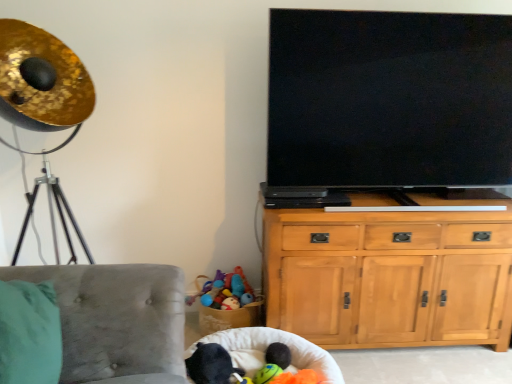
This screenshot has height=384, width=512. Find the location of `white fabric bean bag at lower center`. white fabric bean bag at lower center is located at coordinates (276, 341).

This screenshot has height=384, width=512. Describe the element at coordinates (276, 341) in the screenshot. I see `white fabric bean bag at lower center` at that location.

This screenshot has width=512, height=384. What do you see at coordinates (116, 320) in the screenshot? I see `velvet grey chair at lower left` at bounding box center [116, 320].

At what (x,y) coordinates should I click in order to perform the action: click on white fabric bean bag at lower center. Please return your answer as a coordinate pair (x, y). The width and height of the screenshot is (512, 384). Looking at the image, I should click on (276, 341).

Would you consider velvet grey chair at lower left to be distant from black plush toy at lower center?

That's not correct — velvet grey chair at lower left is a little close to black plush toy at lower center.

Which object is thinner, velvet grey chair at lower left or black plush toy at lower center?

black plush toy at lower center.

From a real-world perspective, is velvet grey chair at lower left below black plush toy at lower center?

No, from a real-world perspective, velvet grey chair at lower left is not under black plush toy at lower center.

How much distance is there between velvet grey chair at lower left and black plush toy at lower center?

They are 19.33 inches apart.

Who is smaller, light wood cabinet at center right or velvet grey chair at lower left?

With smaller size is light wood cabinet at center right.

Is light wood cabinet at center right far from velvet grey chair at lower left?

No, there isn't a large distance between light wood cabinet at center right and velvet grey chair at lower left.

Which is behind, point (405, 315) or point (123, 328)?

The point (405, 315) is behind.

How distant is light wood cabinet at center right from velvet grey chair at lower left?

They are 39.29 inches apart.

Are black plush toy at lower center and velvet grey chair at lower left beside each other?

There is a gap between black plush toy at lower center and velvet grey chair at lower left.

Considering the relative sizes of black plush toy at lower center and velvet grey chair at lower left in the image provided, is black plush toy at lower center bigger than velvet grey chair at lower left?

Actually, black plush toy at lower center might be smaller than velvet grey chair at lower left.

Based on their positions, is black plush toy at lower center located to the left or right of velvet grey chair at lower left?

Clearly, black plush toy at lower center is on the right of velvet grey chair at lower left in the image.

From the image's perspective, is black plush toy at lower center above or below velvet grey chair at lower left?

Clearly, from the image's perspective, black plush toy at lower center is below velvet grey chair at lower left.

From the image's perspective, is black plush toy at lower center below flat screen tv at upper right?

Yes.

Who is shorter, black plush toy at lower center or flat screen tv at upper right?

With less height is black plush toy at lower center.

From a real-world perspective, between black plush toy at lower center and flat screen tv at upper right, who is vertically lower?

From a 3D spatial view, black plush toy at lower center is below.

Considering the sizes of objects black plush toy at lower center and flat screen tv at upper right in the image provided, who is smaller, black plush toy at lower center or flat screen tv at upper right?

Smaller between the two is black plush toy at lower center.

Based on the photo, from a real-world perspective, who is located lower, soft plush toy at lower center or velvet grey chair at lower left?

soft plush toy at lower center is physically lower.

Is soft plush toy at lower center spatially inside velvet grey chair at lower left, or outside of it?

soft plush toy at lower center is outside velvet grey chair at lower left.

From the image's perspective, does soft plush toy at lower center appear lower than velvet grey chair at lower left?

Indeed, from the image's perspective, soft plush toy at lower center is shown beneath velvet grey chair at lower left.

Is soft plush toy at lower center aimed at velvet grey chair at lower left?

No, soft plush toy at lower center is not facing towards velvet grey chair at lower left.

Would you consider white fabric bean bag at lower center to be distant from light wood cabinet at center right?

They are positioned close to each other.

From a real-world perspective, which is physically above, white fabric bean bag at lower center or light wood cabinet at center right?

light wood cabinet at center right is physically above.

Is white fabric bean bag at lower center inside the boundaries of light wood cabinet at center right, or outside?

white fabric bean bag at lower center cannot be found inside light wood cabinet at center right.

In terms of height, does white fabric bean bag at lower center look taller or shorter compared to light wood cabinet at center right?

Considering their sizes, white fabric bean bag at lower center has less height than light wood cabinet at center right.

Is flat screen tv at upper right far away from black plush toy at lower center?

Indeed, flat screen tv at upper right is not near black plush toy at lower center.

Consider the image. Considering the positions of objects flat screen tv at upper right and black plush toy at lower center in the image provided, who is in front, flat screen tv at upper right or black plush toy at lower center?

black plush toy at lower center is closer to the camera.

Looking at the image, does flat screen tv at upper right seem bigger or smaller compared to black plush toy at lower center?

In the image, flat screen tv at upper right appears to be larger than black plush toy at lower center.

From a real-world perspective, which is physically below, flat screen tv at upper right or black plush toy at lower center?

In real-world perspective, black plush toy at lower center is lower.

At what (x,y) coordinates should I click in order to perform the action: click on chair in front of the black plush toy at lower center. Please return your answer as a coordinate pair (x, y). Looking at the image, I should click on (116, 320).

Where is `chair lying on the left of light wood cabinet at center right`? chair lying on the left of light wood cabinet at center right is located at coordinates (116, 320).

Looking at the image, which one is located closer to soft plush toy at lower center, light wood cabinet at center right or black plush toy at lower center?

The object closer to soft plush toy at lower center is black plush toy at lower center.

When comparing their distances from light wood cabinet at center right, does white fabric bean bag at lower center or flat screen tv at upper right seem closer?

white fabric bean bag at lower center lies closer to light wood cabinet at center right than the other object.

When comparing their distances from velvet grey chair at lower left, does soft plush toy at lower center or flat screen tv at upper right seem further?

flat screen tv at upper right is further to velvet grey chair at lower left.

Estimate the real-world distances between objects in this image. Which object is closer to white fabric bean bag at lower center, black plush toy at lower center or velvet grey chair at lower left?

black plush toy at lower center is positioned closer to the anchor white fabric bean bag at lower center.

Estimate the real-world distances between objects in this image. Which object is further from soft plush toy at lower center, flat screen tv at upper right or velvet grey chair at lower left?

Based on the image, flat screen tv at upper right appears to be further to soft plush toy at lower center.

Estimate the real-world distances between objects in this image. Which object is further from black plush toy at lower center, soft plush toy at lower center or flat screen tv at upper right?

The object further to black plush toy at lower center is flat screen tv at upper right.

Based on their spatial positions, is light wood cabinet at center right or black plush toy at lower center closer to flat screen tv at upper right?

light wood cabinet at center right is positioned closer to the anchor flat screen tv at upper right.

From the image, which object appears to be nearer to velvet grey chair at lower left, flat screen tv at upper right or light wood cabinet at center right?

light wood cabinet at center right is closer to velvet grey chair at lower left.

This screenshot has height=384, width=512. What are the coordinates of `bean bag chair located between velvet grey chair at lower left and black plush toy at lower center in the depth direction` in the screenshot? It's located at (276, 341).

The image size is (512, 384). In order to click on animal between white fabric bean bag at lower center and soft plush toy at lower center in the front-back direction in this screenshot , I will do `click(211, 365)`.

Identify the location of toy between velvet grey chair at lower left and flat screen tv at upper right from left to right. (273, 363).

Locate an element on the screen. Image resolution: width=512 pixels, height=384 pixels. toy between flat screen tv at upper right and white fabric bean bag at lower center in the vertical direction is located at coordinates (273, 363).